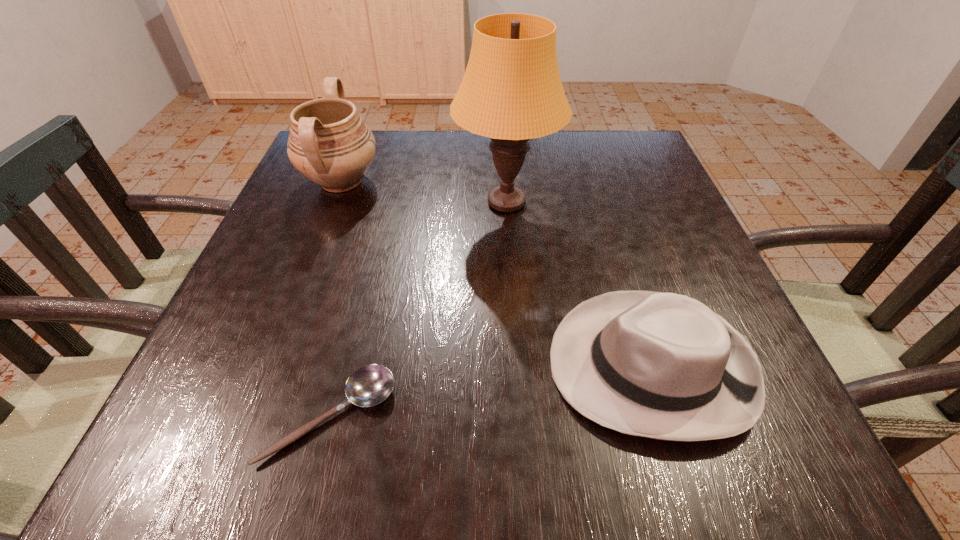
Find the location of a particular element. The height and width of the screenshot is (540, 960). free spot between the tallest object and the shortest object is located at coordinates (419, 309).

At what (x,y) coordinates should I click in order to perform the action: click on unoccupied area between the third shortest object and the lampshade. Please return your answer as a coordinate pair (x, y). Looking at the image, I should click on (423, 192).

Where is `vacant space in between the tallest object and the urn`? This screenshot has height=540, width=960. vacant space in between the tallest object and the urn is located at coordinates (423, 192).

At what (x,y) coordinates should I click in order to perform the action: click on free space between the ladle and the urn. Please return your answer as a coordinate pair (x, y). Image resolution: width=960 pixels, height=540 pixels. Looking at the image, I should click on (336, 299).

You are a GUI agent. You are given a task and a screenshot of the screen. Output one action in this format:
    pyautogui.click(x=<x>, y=<y>)
    Task: Click on the free point between the urn and the ladle
    This screenshot has height=540, width=960.
    Given the screenshot: What is the action you would take?
    pyautogui.click(x=336, y=299)

Select which object is the third closest to the shortest object. Please provide its 2D coordinates. Your answer should be formatted as a tuple, i.e. [(x, y)], where the tuple contains the x and y coordinates of a point satisfying the conditions above.

[(329, 143)]

Locate an element on the screen. The image size is (960, 540). object that is the nearest to the urn is located at coordinates (511, 92).

The height and width of the screenshot is (540, 960). I want to click on free region that satisfies the following two spatial constraints: 1. on the front-facing side of the urn; 2. on the back side of the lampshade, so click(333, 202).

Where is `free space that satisfies the following two spatial constraints: 1. on the front-facing side of the shortest object; 2. on the right side of the second tallest object`? free space that satisfies the following two spatial constraints: 1. on the front-facing side of the shortest object; 2. on the right side of the second tallest object is located at coordinates (252, 416).

You are a GUI agent. You are given a task and a screenshot of the screen. Output one action in this format:
    pyautogui.click(x=<x>, y=<y>)
    Task: Click on the vacant region that satisfies the following two spatial constraints: 1. on the front-facing side of the tallest object; 2. on the left side of the third shortest object
    The width and height of the screenshot is (960, 540).
    Given the screenshot: What is the action you would take?
    pyautogui.click(x=333, y=202)